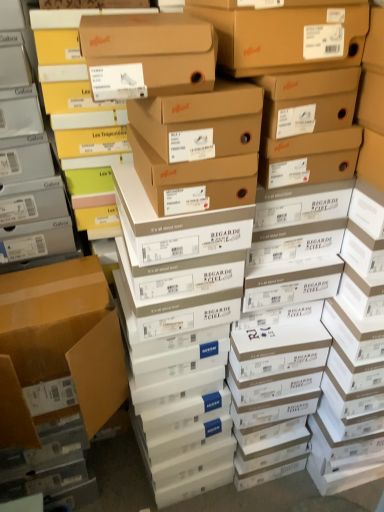
Measure the distance between point (x=6, y=234) and camera.

Point (x=6, y=234) and camera are 3.72 feet apart from each other.

Describe the element at coordinates (28, 168) in the screenshot. I see `matte gray shoebox at left` at that location.

This screenshot has height=512, width=384. I want to click on matte gray shoebox at left, so click(x=28, y=168).

This screenshot has height=512, width=384. Describe the element at coordinates (60, 345) in the screenshot. I see `matte cardboard box at left` at that location.

Identify the location of matte cardboard box at left. (60, 345).

What is the approximate height of matte cardboard box at left?

matte cardboard box at left is 14.68 inches tall.

Locate an element on the screen. matte gray shoebox at left is located at coordinates (28, 168).

Is matte gray shoebox at left to the left of matte cardboard box at left from the viewer's perspective?

Indeed, matte gray shoebox at left is positioned on the left side of matte cardboard box at left.

Is matte gray shoebox at left positioned behind matte cardboard box at left?

No, matte gray shoebox at left is closer to the camera.

Which is farther from the camera, (20, 29) or (33, 319)?

Positioned behind is point (33, 319).

From the image's perspective, is matte gray shoebox at left located above or below matte cardboard box at left?

matte gray shoebox at left is above matte cardboard box at left.

From a real-world perspective, which object stands above the other?

matte gray shoebox at left is physically above.

Considering the sizes of objects matte gray shoebox at left and matte cardboard box at left in the image provided, who is wider, matte gray shoebox at left or matte cardboard box at left?

Wider between the two is matte cardboard box at left.

Who is taller, matte gray shoebox at left or matte cardboard box at left?

With more height is matte gray shoebox at left.

Based on the photo, between matte gray shoebox at left and matte cardboard box at left, which one has smaller size?

With smaller size is matte cardboard box at left.

Would you say matte gray shoebox at left is outside matte cardboard box at left?

matte gray shoebox at left is positioned outside matte cardboard box at left.

Is matte gray shoebox at left next to matte cardboard box at left?

matte gray shoebox at left is not next to matte cardboard box at left, and they're not touching.

Is matte gray shoebox at left facing away from matte cardboard box at left?

No, matte gray shoebox at left is not facing the opposite direction of matte cardboard box at left.

Measure the distance between matte gray shoebox at left and matte cardboard box at left.

matte gray shoebox at left and matte cardboard box at left are 10.91 inches apart from each other.

You are a GUI agent. You are given a task and a screenshot of the screen. Output one action in this format:
    pyautogui.click(x=<x>, y=<y>)
    Task: Click on the shelf above the matte cardboard box at left (from the image's perspective)
    The width and height of the screenshot is (384, 512).
    Given the screenshot: What is the action you would take?
    pyautogui.click(x=28, y=168)

Between matte cardboard box at left and matte gray shoebox at left, which one appears on the left side from the viewer's perspective?

From the viewer's perspective, matte gray shoebox at left appears more on the left side.

Who is more distant, matte cardboard box at left or matte gray shoebox at left?

Positioned behind is matte cardboard box at left.

Does point (82, 376) appear closer or farther from the camera than point (52, 241)?

Point (82, 376) is closer to the camera than point (52, 241).

From the image's perspective, is matte cardboard box at left under matte gray shoebox at left?

Correct, matte cardboard box at left appears lower than matte gray shoebox at left in the image.

From a real-world perspective, which object rests below the other?

In real-world perspective, matte cardboard box at left is lower.

Looking at this image, in terms of width, does matte cardboard box at left look wider or thinner when compared to matte gray shoebox at left?

In the image, matte cardboard box at left appears to be wider than matte gray shoebox at left.

Considering the relative sizes of matte cardboard box at left and matte gray shoebox at left in the image provided, is matte cardboard box at left taller than matte gray shoebox at left?

Answer: Incorrect, the height of matte cardboard box at left is not larger of that of matte gray shoebox at left.

Between matte cardboard box at left and matte gray shoebox at left, which one has smaller size?

matte cardboard box at left is smaller.

Is matte cardboard box at left inside or outside of matte gray shoebox at left?

matte cardboard box at left is outside matte gray shoebox at left.

Is matte cardboard box at left far from matte gray shoebox at left?

matte cardboard box at left is actually quite close to matte gray shoebox at left.

Does matte cardboard box at left turn towards matte gray shoebox at left?

No, matte cardboard box at left is not turned towards matte gray shoebox at left.

How far apart are matte cardboard box at left and matte gray shoebox at left?

A distance of 27.71 centimeters exists between matte cardboard box at left and matte gray shoebox at left.

Image resolution: width=384 pixels, height=512 pixels. What are the coordinates of `box below the matte gray shoebox at left (from the image's perspective)` in the screenshot? It's located at (60, 345).

This screenshot has width=384, height=512. Find the location of `box lying below the matte gray shoebox at left (from the image's perspective)`. box lying below the matte gray shoebox at left (from the image's perspective) is located at coordinates (60, 345).

Find the location of a particular element. This screenshot has width=384, height=512. shelf located above the matte cardboard box at left (from a real-world perspective) is located at coordinates (28, 168).